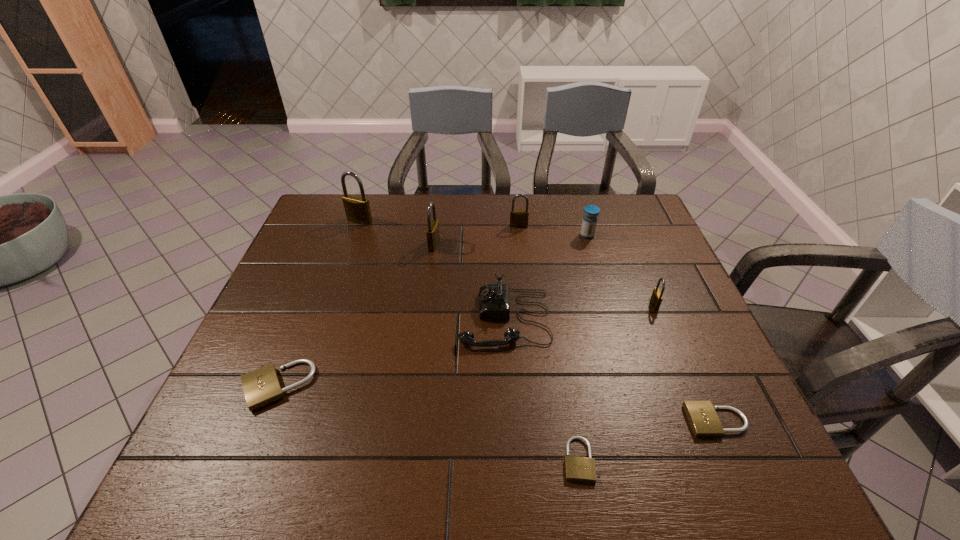
In order to click on free space that is in between the biggest beige padlock and the second nearest brass padlock in this screenshot , I will do `click(355, 315)`.

The image size is (960, 540). I want to click on empty space between the shortest padlock and the telephone, so click(x=541, y=389).

This screenshot has width=960, height=540. What are the coordinates of `free space between the fourth farthest padlock and the second biggest beige padlock` in the screenshot? It's located at (685, 363).

The width and height of the screenshot is (960, 540). In order to click on vacant region between the third farthest brass padlock and the second biggest beige padlock in this screenshot , I will do `click(575, 333)`.

Where is `vacant space that is in between the telephone and the blue medicine`? The image size is (960, 540). vacant space that is in between the telephone and the blue medicine is located at coordinates (546, 276).

Find the location of `free space between the second biggest beige padlock and the fourth tallest padlock`. free space between the second biggest beige padlock and the fourth tallest padlock is located at coordinates (685, 363).

Locate an element on the screen. free spot between the medicine and the telephone is located at coordinates (546, 276).

Find the location of `empty space between the leftmost beige padlock and the rightmost brass padlock`. empty space between the leftmost beige padlock and the rightmost brass padlock is located at coordinates (466, 345).

Locate which object ranks fourth in proximity to the biggest beige padlock. Please provide its 2D coordinates. Your answer should be formatted as a tuple, i.e. [(x, y)], where the tuple contains the x and y coordinates of a point satisfying the conditions above.

[(357, 209)]

Where is `object that is the fourth closest one to the third farthest padlock`? object that is the fourth closest one to the third farthest padlock is located at coordinates (589, 222).